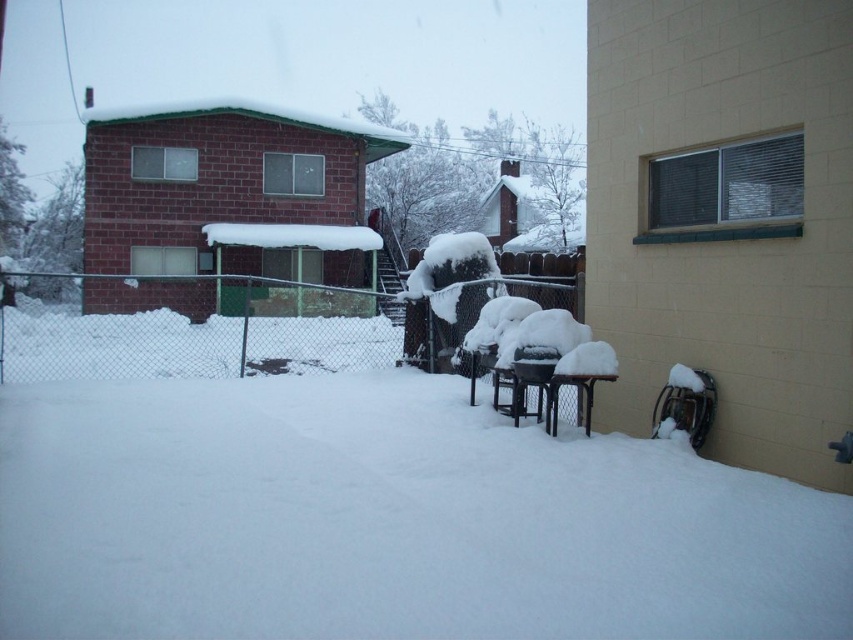
Between white fluffy snow at center and metallic chain-link fence at center, which one has more height?

With more height is metallic chain-link fence at center.

Is point (447, 632) farther from camera compared to point (231, 314)?

No.

Is point (576, 500) less distant than point (349, 340)?

Yes, point (576, 500) is in front of point (349, 340).

At what (x,y) coordinates should I click in order to perform the action: click on white fluffy snow at center. Please return your answer as a coordinate pair (x, y). Looking at the image, I should click on (387, 520).